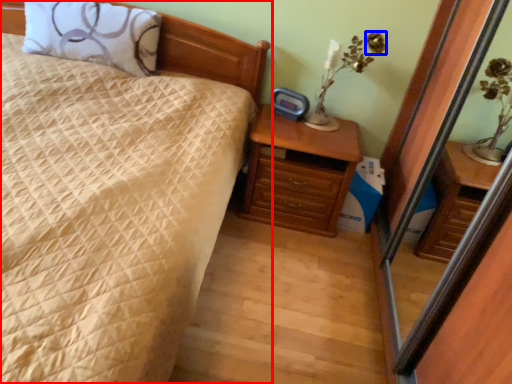
Question: Which object is closer to the camera taking this photo, bed (highlighted by a red box) or flower (highlighted by a blue box)?

Choices:
 (A) bed
 (B) flower

Answer: (A)